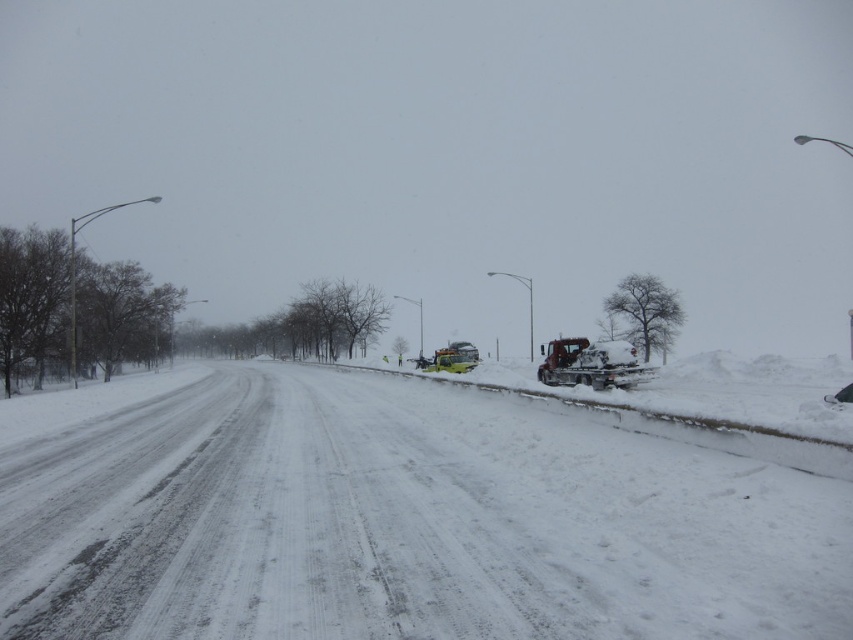
This screenshot has width=853, height=640. What do you see at coordinates (590, 364) in the screenshot? I see `snow-covered metal snowplow at right` at bounding box center [590, 364].

How far apart are snow-covered metal snowplow at right and yellow metallic snowplow at center?

A distance of 33.16 feet exists between snow-covered metal snowplow at right and yellow metallic snowplow at center.

Which is in front, point (637, 369) or point (457, 358)?

Positioned in front is point (637, 369).

At what (x,y) coordinates should I click in order to perform the action: click on snow-covered metal snowplow at right. Please return your answer as a coordinate pair (x, y). The width and height of the screenshot is (853, 640). Looking at the image, I should click on (590, 364).

In the scene shown: Who is positioned more to the right, white powdery snow at road center or snow-covered metal snowplow at right?

Positioned to the right is snow-covered metal snowplow at right.

Is white powdery snow at road center shorter than snow-covered metal snowplow at right?

Yes, white powdery snow at road center is shorter than snow-covered metal snowplow at right.

Who is more forward, (381, 618) or (550, 374)?

Point (381, 618) is more forward.

Where is `white powdery snow at road center`? This screenshot has height=640, width=853. white powdery snow at road center is located at coordinates (404, 524).

The width and height of the screenshot is (853, 640). What do you see at coordinates (404, 524) in the screenshot?
I see `white powdery snow at road center` at bounding box center [404, 524].

Which of these two, white powdery snow at road center or yellow metallic snowplow at center, stands taller?

yellow metallic snowplow at center

Who is more distant from viewer, (730, 616) or (451, 352)?

The point (451, 352) is behind.

This screenshot has height=640, width=853. What are the coordinates of `white powdery snow at road center` in the screenshot? It's located at (404, 524).